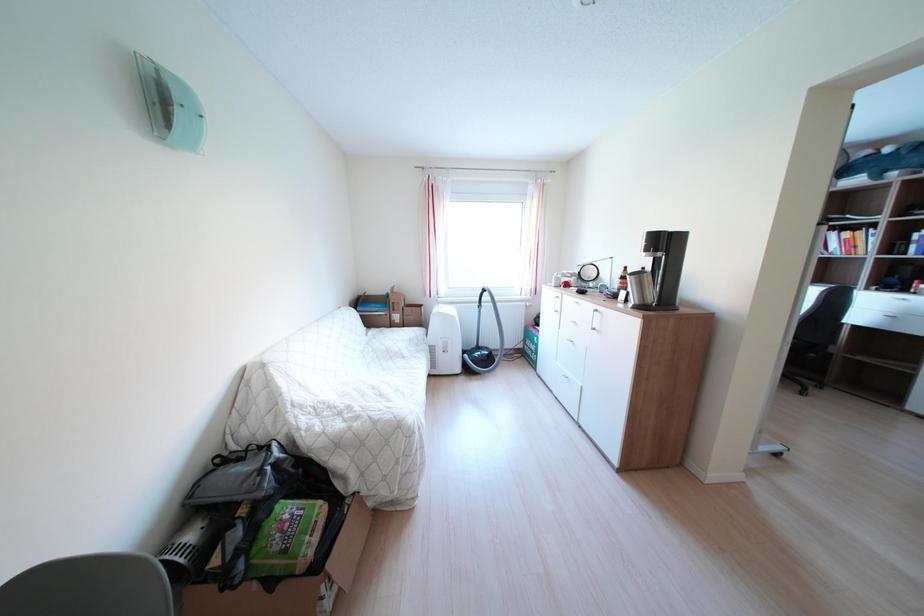
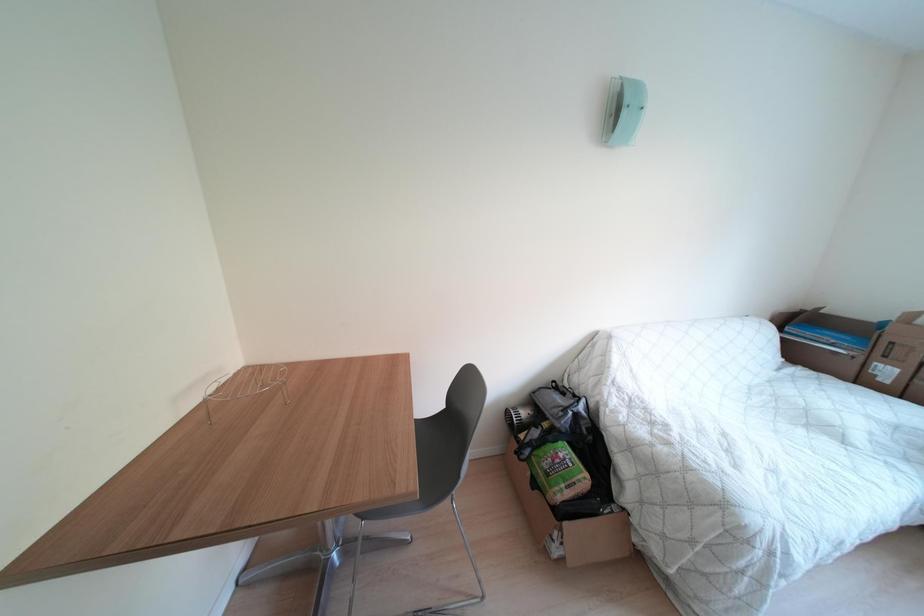
Question: The images are taken continuously from a first-person perspective. In which direction is your viewpoint rotating?

Choices:
 (A) Left
 (B) Right
 (C) Up
 (D) Down

Answer: (A)